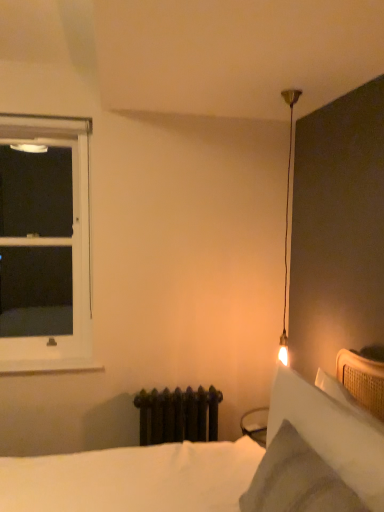
Question: Based on their sizes in the image, would you say white plastic window at left is bigger or smaller than white soft pillow at upper right?

Choices:
 (A) small
 (B) big

Answer: (B)

Question: From the image's perspective, is white plastic window at left located above or below white soft pillow at upper right?

Choices:
 (A) below
 (B) above

Answer: (B)

Question: Which of these objects is positioned closest to the white soft bed at lower right?

Choices:
 (A) white matte window sill at lower left
 (B) white plastic window at left
 (C) white soft pillow at upper right

Answer: (C)

Question: Estimate the real-world distances between objects in this image. Which object is closer to the white matte window sill at lower left?

Choices:
 (A) white plastic window at left
 (B) white soft bed at lower right
 (C) white soft pillow at upper right

Answer: (B)